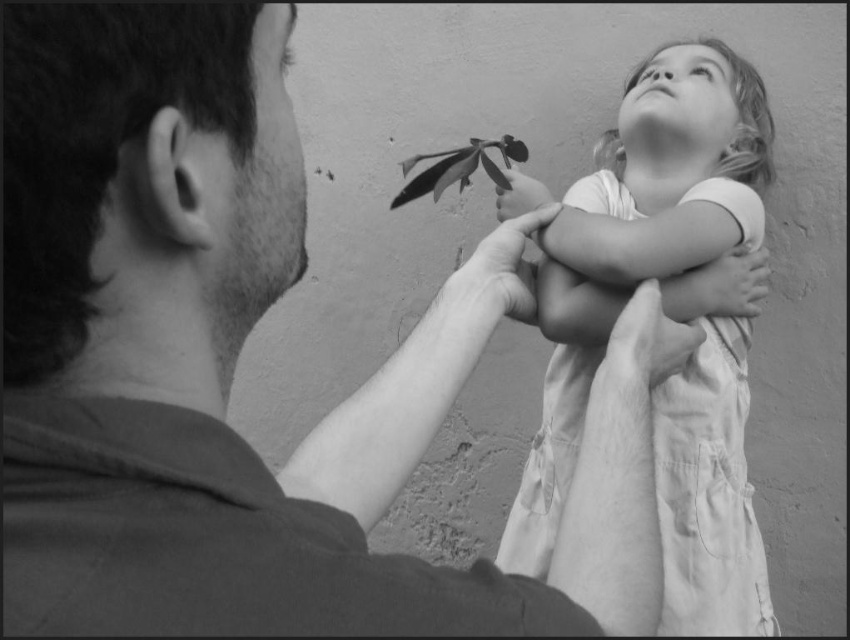
Question: Which of the following is the farthest from the observer?

Choices:
 (A) white cotton dress at upper right
 (B) smooth skin at upper center

Answer: (A)

Question: Does white cotton dress at upper right appear over smooth skin at upper center?

Choices:
 (A) yes
 (B) no

Answer: (A)

Question: Which object is positioned closest to the white cotton dress at upper right?

Choices:
 (A) smooth skin at upper center
 (B) smooth glossy leaf at upper center

Answer: (B)

Question: Is smooth skin at upper center further to camera compared to smooth glossy leaf at upper center?

Choices:
 (A) no
 (B) yes

Answer: (A)

Question: In this image, where is white cotton dress at upper right located relative to smooth glossy leaf at upper center?

Choices:
 (A) below
 (B) above

Answer: (A)

Question: Which point is closer to the camera?

Choices:
 (A) smooth skin at upper center
 (B) white cotton dress at upper right

Answer: (A)